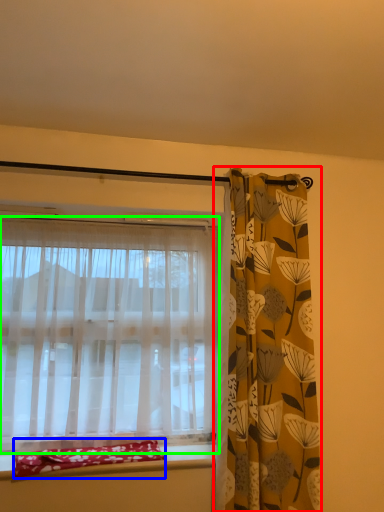
Question: Estimate the real-world distances between objects in this image. Which object is farther from curtain (highlighted by a red box), material (highlighted by a blue box) or curtain (highlighted by a green box)?

Choices:
 (A) material
 (B) curtain

Answer: (A)